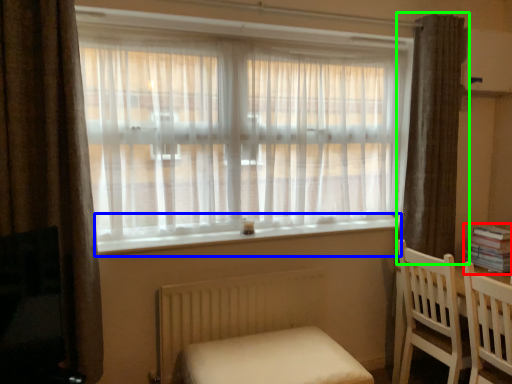
Question: Considering the real-world distances, which object is closest to book (highlighted by a red box)? window sill (highlighted by a blue box) or curtain (highlighted by a green box).

Choices:
 (A) window sill
 (B) curtain

Answer: (B)